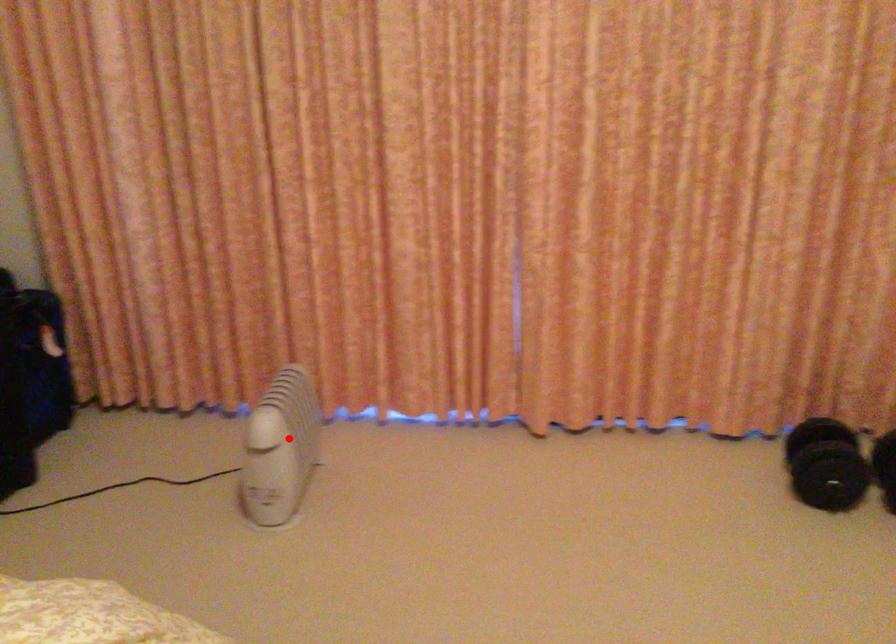
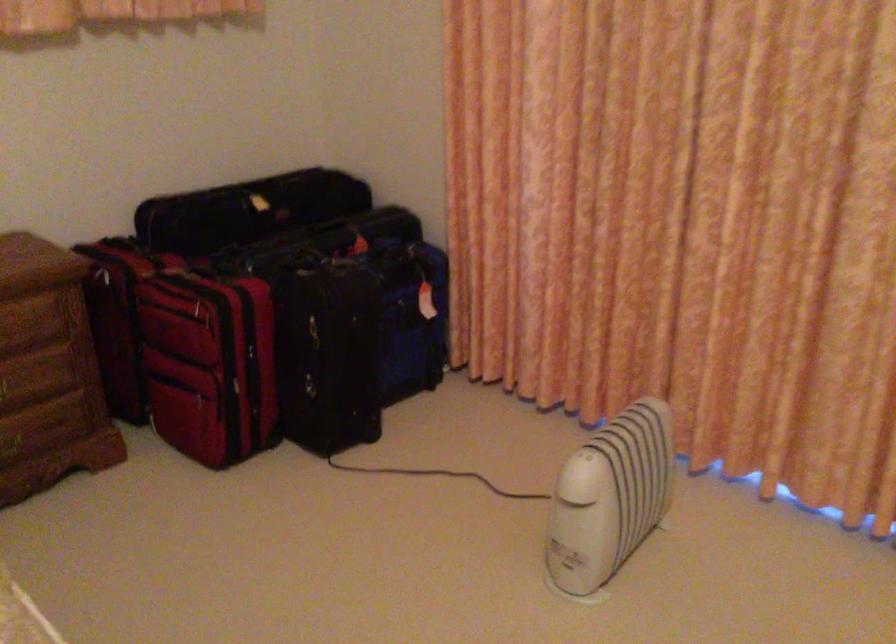
Question: I am providing you with two images of the same scene from different viewpoints. Given a red point in image1, look at the same physical point in image2. Is it:

Choices:
 (A) Closer to the viewpoint
 (B) Farther from the viewpoint

Answer: (A)